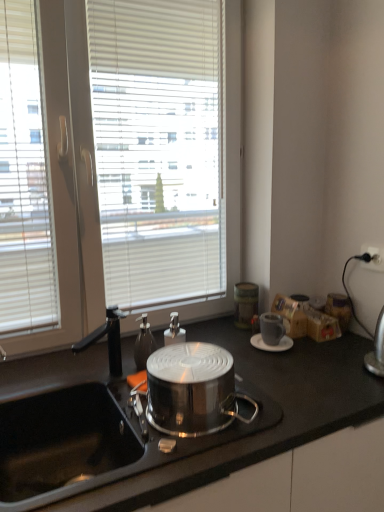
Question: Is matte gray cup at right closer to camera compared to white plastic power outlet at upper right?

Choices:
 (A) yes
 (B) no

Answer: (A)

Question: From the image's perspective, would you say matte gray cup at right is shown under white plastic power outlet at upper right?

Choices:
 (A) no
 (B) yes

Answer: (B)

Question: Is matte gray cup at right facing towards white plastic power outlet at upper right?

Choices:
 (A) yes
 (B) no

Answer: (B)

Question: Is matte gray cup at right outside of white plastic power outlet at upper right?

Choices:
 (A) no
 (B) yes

Answer: (B)

Question: From the image's perspective, would you say matte gray cup at right is positioned over white plastic power outlet at upper right?

Choices:
 (A) no
 (B) yes

Answer: (A)

Question: From a real-world perspective, is matte gray cup at right positioned over white plastic power outlet at upper right based on gravity?

Choices:
 (A) no
 (B) yes

Answer: (A)

Question: Can you confirm if shiny metallic pot at center is wider than translucent glass soap dispenser at center?

Choices:
 (A) no
 (B) yes

Answer: (B)

Question: From a real-world perspective, is shiny metallic pot at center physically below translucent glass soap dispenser at center?

Choices:
 (A) yes
 (B) no

Answer: (A)

Question: Does shiny metallic pot at center turn towards translucent glass soap dispenser at center?

Choices:
 (A) no
 (B) yes

Answer: (A)

Question: From the image's perspective, is shiny metallic pot at center beneath translucent glass soap dispenser at center?

Choices:
 (A) yes
 (B) no

Answer: (A)

Question: Considering the relative sizes of shiny metallic pot at center and translucent glass soap dispenser at center in the image provided, is shiny metallic pot at center bigger than translucent glass soap dispenser at center?

Choices:
 (A) yes
 (B) no

Answer: (A)

Question: Is shiny metallic pot at center far away from translucent glass soap dispenser at center?

Choices:
 (A) yes
 (B) no

Answer: (B)

Question: From a real-world perspective, is matte gray cup at right physically above translucent glass soap dispenser at center?

Choices:
 (A) yes
 (B) no

Answer: (B)